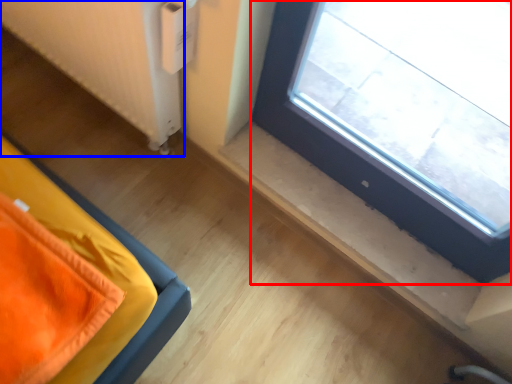
Question: Which object is further to the camera taking this photo, window (highlighted by a red box) or radiator (highlighted by a blue box)?

Choices:
 (A) window
 (B) radiator

Answer: (B)